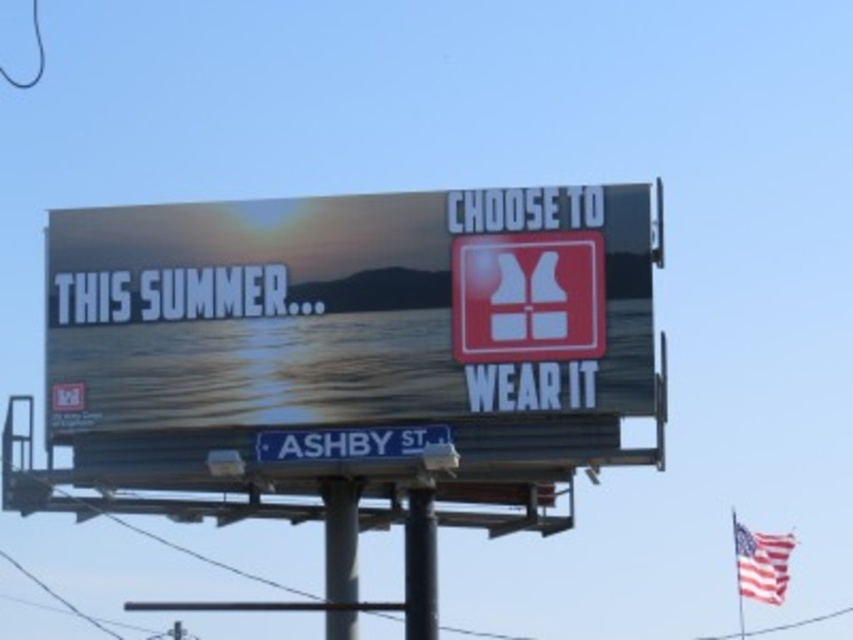
You are standing directly in front of the billboard. Where is the metallic gray pole at center located?

The metallic gray pole at center is located at the center of the billboard.

You are a painter standing in front of the billboard and need to paint both the metallic gray pole at center and the black metal pole at center. Which pole should you paint first if you want to paint the one that is closer to you first?

You should paint the metallic gray pole at center first because the black metal pole at center is behind it, making the metallic gray pole closer to you.

You are a maintenance worker standing at the base of the metallic gray pole at center. You need to reach the red fabric flag at upper right for repairs. Given that your ladder can extend up to 25 meters, will you be able to reach it?

The distance between the metallic gray pole at center and the red fabric flag at upper right is 26.09 meters. Since the ladder can only extend to 25 meters, you won